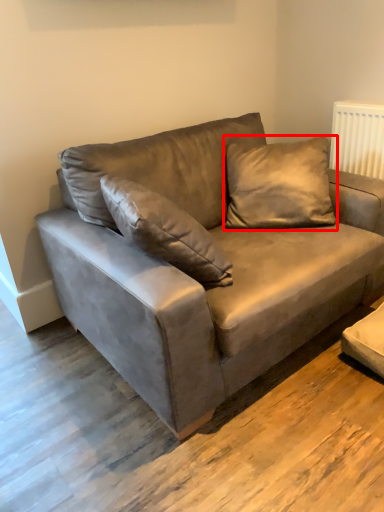
Question: From the image's perspective, where is pillow (annotated by the red box) located relative to studio couch?

Choices:
 (A) below
 (B) above

Answer: (B)